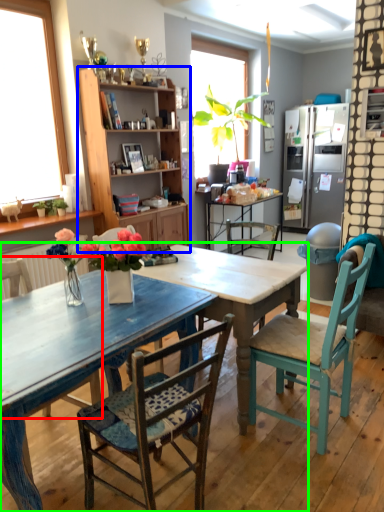
Question: Based on their relative distances, which object is nearer to chair (highlighted by a red box)? Choose from cabinetry (highlighted by a blue box) and kitchen & dining room table (highlighted by a green box).

Choices:
 (A) cabinetry
 (B) kitchen & dining room table

Answer: (B)